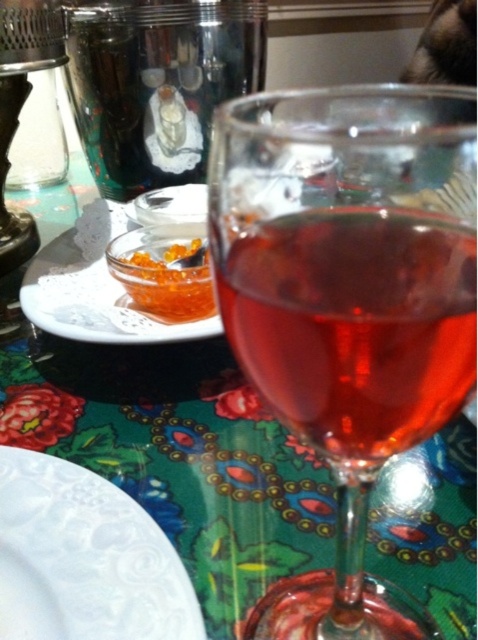
Is transparent glass wine glass at center taller than white lace plate at upper left?

Correct, transparent glass wine glass at center is much taller as white lace plate at upper left.

Identify the location of transparent glass wine glass at center. The image size is (478, 640). (347, 301).

At what (x,y) coordinates should I click in order to perform the action: click on transparent glass wine glass at center. Please return your answer as a coordinate pair (x, y). Looking at the image, I should click on 347,301.

Is point (102, 13) more distant than point (198, 300)?

Yes, it is behind point (198, 300).

Consider the image. Does shiny metallic cup at upper left appear under orange caviar at center?

No, shiny metallic cup at upper left is not below orange caviar at center.

Which is in front, point (246, 76) or point (153, 264)?

Point (153, 264) is in front.

Find the location of a particular element. Image resolution: width=478 pixels, height=640 pixels. shiny metallic cup at upper left is located at coordinates (156, 83).

Measure the distance between translucent glass wine at center and orange caviar at center.

A distance of 6.62 inches exists between translucent glass wine at center and orange caviar at center.

At what (x,y) coordinates should I click in order to perform the action: click on translucent glass wine at center. Please return your answer as a coordinate pair (x, y). The width and height of the screenshot is (478, 640). Looking at the image, I should click on (354, 324).